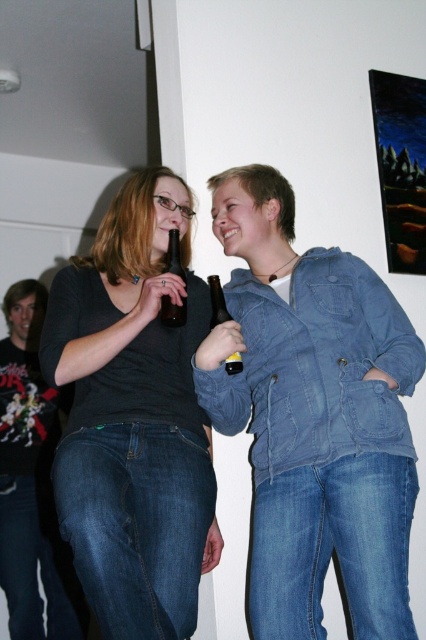
You are a bartender trying to place the brown glass bottle at center and the denim jacket at lower right on a shelf. Which object should you place first if you want to fit both items on the shelf without rearranging?

The denim jacket at lower right is larger in size than the brown glass bottle at center, so you should place the denim jacket at lower right first to ensure both items fit on the shelf.

You are a photographer setting up for a group photo. You notice the matte black shirt at center and the dark gray sweater at left. Which clothing item is positioned higher in the frame?

The matte black shirt at center is positioned higher in the frame than the dark gray sweater at left.

You are a bartender preparing drinks for two guests. One guest is wearing a denim jacket at lower right, and the other has a matte glass bottle at center. If you need to place a new drink between them, which object should you avoid placing the drink near to ensure it doesn

The denim jacket at lower right has a greater height compared to the matte glass bottle at center, so placing the drink near the denim jacket at lower right might be less stable due to its height, making it more likely to tip over.